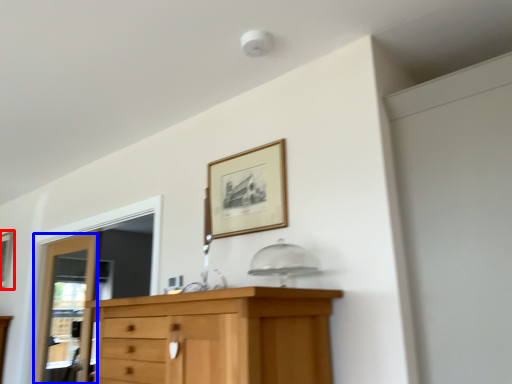
Question: Which of the following is the farthest to the observer, picture frame (highlighted by a red box) or door (highlighted by a blue box)?

Choices:
 (A) picture frame
 (B) door

Answer: (A)